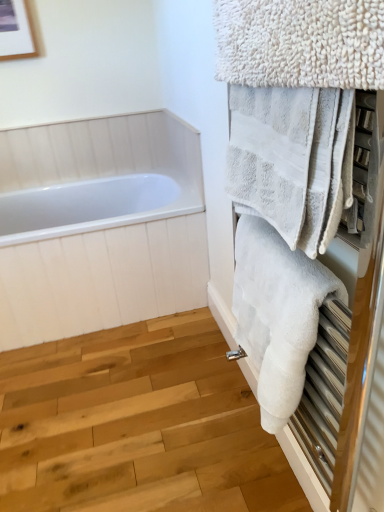
Question: Can you confirm if white fluffy towel at right, marked as the 3th towel in a top-to-bottom arrangement, is positioned to the right of white fluffy towel at upper right, marked as the third towel in a bottom-to-top arrangement?

Choices:
 (A) no
 (B) yes

Answer: (B)

Question: Can you confirm if white fluffy towel at right, placed as the 1th towel when sorted from bottom to top, is thinner than white fluffy towel at upper right, marked as the third towel in a bottom-to-top arrangement?

Choices:
 (A) no
 (B) yes

Answer: (A)

Question: Could white fluffy towel at upper right, marked as the third towel in a bottom-to-top arrangement, be considered to be inside white fluffy towel at right, placed as the 1th towel when sorted from bottom to top?

Choices:
 (A) yes
 (B) no

Answer: (B)

Question: Is white fluffy towel at right, marked as the 3th towel in a top-to-bottom arrangement, shorter than white fluffy towel at upper right, placed as the first towel when sorted from top to bottom?

Choices:
 (A) no
 (B) yes

Answer: (A)

Question: From the image's perspective, is white fluffy towel at right, placed as the 1th towel when sorted from bottom to top, on top of white fluffy towel at upper right, marked as the third towel in a bottom-to-top arrangement?

Choices:
 (A) no
 (B) yes

Answer: (A)

Question: From a real-world perspective, relative to white fluffy towel at right, marked as the 3th towel in a top-to-bottom arrangement, is white fluffy towel at upper right, the 2th towel from the top, vertically above or below?

Choices:
 (A) above
 (B) below

Answer: (A)

Question: From the image's perspective, relative to white fluffy towel at right, marked as the 3th towel in a top-to-bottom arrangement, is white fluffy towel at upper right, the 2th towel from the top, above or below?

Choices:
 (A) above
 (B) below

Answer: (A)

Question: Is white fluffy towel at upper right, the 2th towel from the top, bigger or smaller than white fluffy towel at right, placed as the 1th towel when sorted from bottom to top?

Choices:
 (A) big
 (B) small

Answer: (B)

Question: Considering the positions of point (339, 186) and point (278, 409), is point (339, 186) closer or farther from the camera than point (278, 409)?

Choices:
 (A) closer
 (B) farther

Answer: (A)

Question: Is point (317, 296) closer or farther from the camera than point (216, 42)?

Choices:
 (A) closer
 (B) farther

Answer: (A)

Question: From a real-world perspective, is white fluffy towel at right, marked as the 3th towel in a top-to-bottom arrangement, above or below white fluffy towel at upper right, placed as the first towel when sorted from top to bottom?

Choices:
 (A) above
 (B) below

Answer: (B)

Question: From the image's perspective, is white fluffy towel at right, placed as the 1th towel when sorted from bottom to top, located above or below white fluffy towel at upper right, placed as the first towel when sorted from top to bottom?

Choices:
 (A) above
 (B) below

Answer: (B)

Question: Considering the positions of white fluffy towel at right, placed as the 1th towel when sorted from bottom to top, and white fluffy towel at upper right, marked as the third towel in a bottom-to-top arrangement, in the image, is white fluffy towel at right, placed as the 1th towel when sorted from bottom to top, bigger or smaller than white fluffy towel at upper right, marked as the third towel in a bottom-to-top arrangement,?

Choices:
 (A) big
 (B) small

Answer: (A)

Question: Would you say white fluffy towel at upper right, marked as the third towel in a bottom-to-top arrangement, is inside or outside white fluffy towel at right, placed as the 1th towel when sorted from bottom to top?

Choices:
 (A) inside
 (B) outside

Answer: (B)

Question: Considering the positions of point (266, 61) and point (286, 403), is point (266, 61) closer or farther from the camera than point (286, 403)?

Choices:
 (A) farther
 (B) closer

Answer: (B)